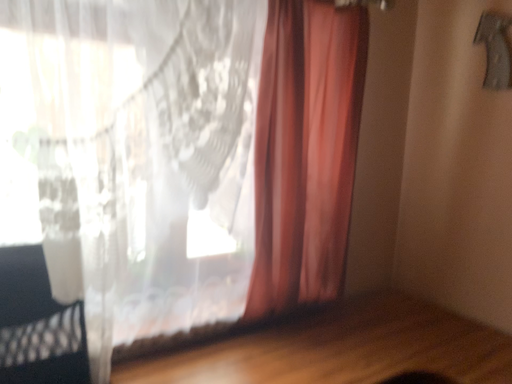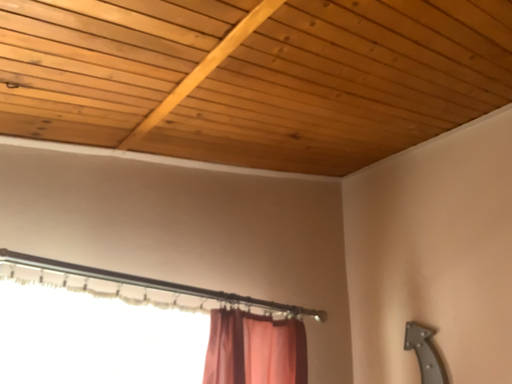
Question: How did the camera likely rotate when shooting the video?

Choices:
 (A) rotated upward
 (B) rotated downward

Answer: (A)